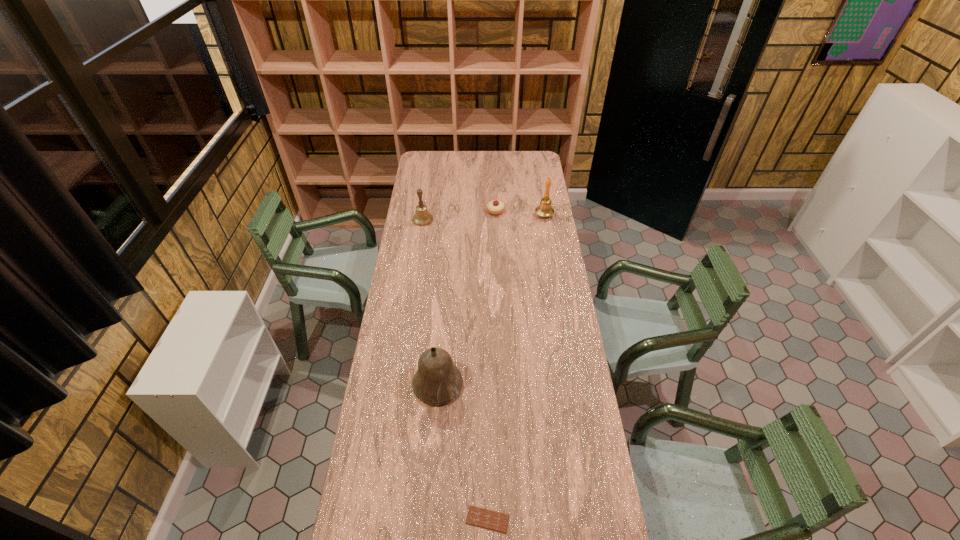
Find the location of a particular element. The height and width of the screenshot is (540, 960). unoccupied position between the pastry and the chocolate bar is located at coordinates (492, 365).

The width and height of the screenshot is (960, 540). Find the location of `blank region between the pastry and the second nearest object`. blank region between the pastry and the second nearest object is located at coordinates (467, 298).

At what (x,y) coordinates should I click in order to perform the action: click on object that is the second closest to the nearest bell. Please return your answer as a coordinate pair (x, y). The image size is (960, 540). Looking at the image, I should click on (422, 217).

Locate which object ranks in proximity to the fourth tallest object. Please provide its 2D coordinates. Your answer should be formatted as a tuple, i.e. [(x, y)], where the tuple contains the x and y coordinates of a point satisfying the conditions above.

[(545, 209)]

Locate an element on the screen. bell identified as the closest to the second nearest object is located at coordinates (422, 217).

What are the coordinates of `the second closest bell relative to the rightmost bell` in the screenshot? It's located at (438, 381).

I want to click on vacant point that satisfies the following two spatial constraints: 1. on the front side of the rightmost bell; 2. on the left side of the pastry, so click(495, 215).